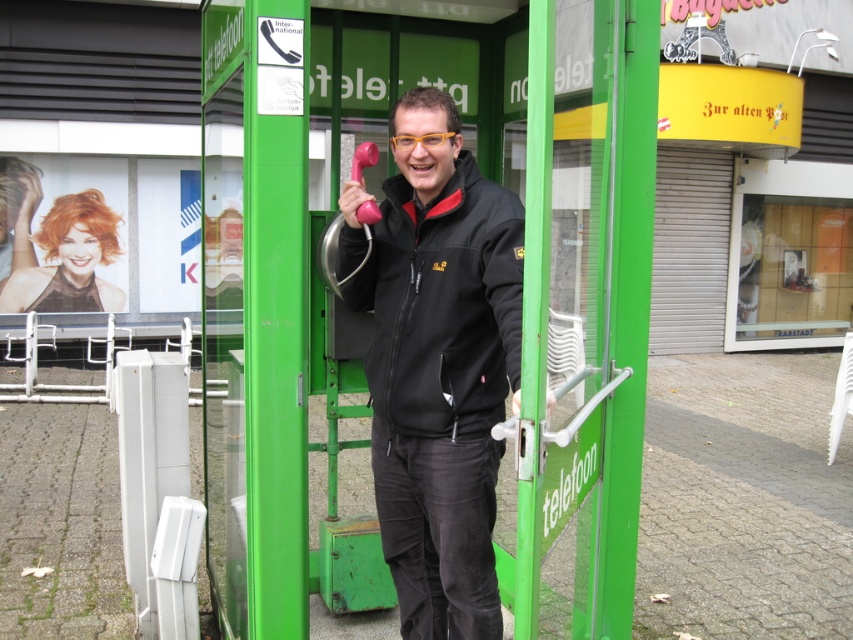
Does green plastic telephone booth at center appear over black matte jacket at center?

Indeed, green plastic telephone booth at center is positioned over black matte jacket at center.

Who is positioned more to the right, green plastic telephone booth at center or black matte jacket at center?

black matte jacket at center

Where is `green plastic telephone booth at center`? green plastic telephone booth at center is located at coordinates (422, 312).

Does point (375, 465) come farther from viewer compared to point (440, 413)?

Yes, point (375, 465) is behind point (440, 413).

Who is lower down, black matte jacket at center or black softshell jacket at center?

black matte jacket at center is below.

Is point (433, 150) positioned in front of point (486, 316)?

Yes, point (433, 150) is in front of point (486, 316).

Find the location of a particular element. The width and height of the screenshot is (853, 640). black matte jacket at center is located at coordinates (440, 368).

Is green plastic telephone booth at center bigger than black softshell jacket at center?

Yes, green plastic telephone booth at center is bigger than black softshell jacket at center.

Is green plastic telephone booth at center to the right of black softshell jacket at center from the viewer's perspective?

In fact, green plastic telephone booth at center is to the left of black softshell jacket at center.

Does point (555, 576) come farther from viewer compared to point (444, 419)?

Yes.

Locate an element on the screen. Image resolution: width=853 pixels, height=640 pixels. green plastic telephone booth at center is located at coordinates (422, 312).